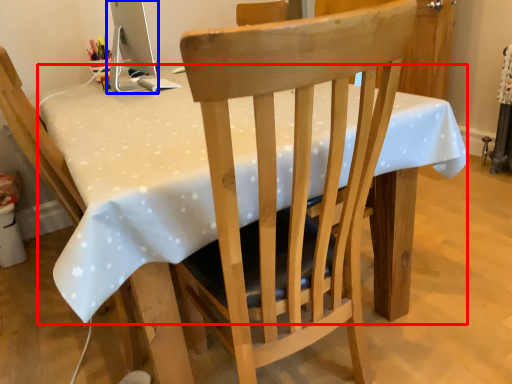
Question: Among these objects, which one is nearest to the camera, table (highlighted by a red box) or computer monitor (highlighted by a blue box)?

Choices:
 (A) table
 (B) computer monitor

Answer: (A)